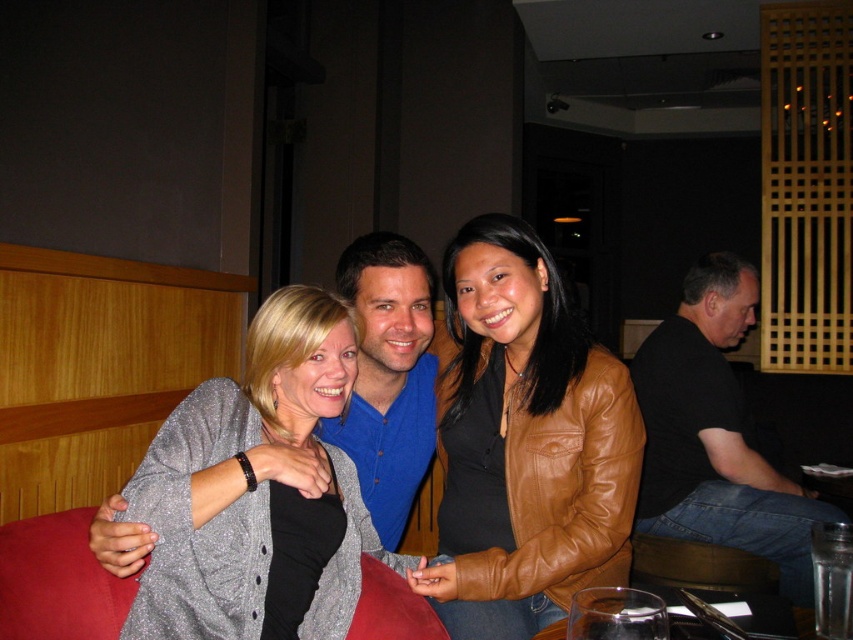
Does brown leather jacket at center have a lesser width compared to black cotton shirt at right?

Indeed, brown leather jacket at center has a lesser width compared to black cotton shirt at right.

Is brown leather jacket at center above black cotton shirt at right?

Yes.

Where is `brown leather jacket at center`? The height and width of the screenshot is (640, 853). brown leather jacket at center is located at coordinates (525, 442).

Which is more to the right, sparkly gray cardigan at center or black cotton shirt at right?

black cotton shirt at right

Between sparkly gray cardigan at center and black cotton shirt at right, which one is positioned lower?

black cotton shirt at right

Is point (318, 413) positioned behind point (815, 506)?

No, it is in front of (815, 506).

The width and height of the screenshot is (853, 640). Find the location of `sparkly gray cardigan at center`. sparkly gray cardigan at center is located at coordinates (258, 492).

Can you confirm if black cotton shirt at right is positioned above transparent glass at lower center?

Yes, black cotton shirt at right is above transparent glass at lower center.

Does black cotton shirt at right lie behind transparent glass at lower center?

Yes.

What do you see at coordinates (715, 435) in the screenshot? I see `black cotton shirt at right` at bounding box center [715, 435].

You are a GUI agent. You are given a task and a screenshot of the screen. Output one action in this format:
    pyautogui.click(x=<x>, y=<y>)
    Task: Click on the black cotton shirt at right
    The image size is (853, 640).
    Given the screenshot: What is the action you would take?
    pyautogui.click(x=715, y=435)